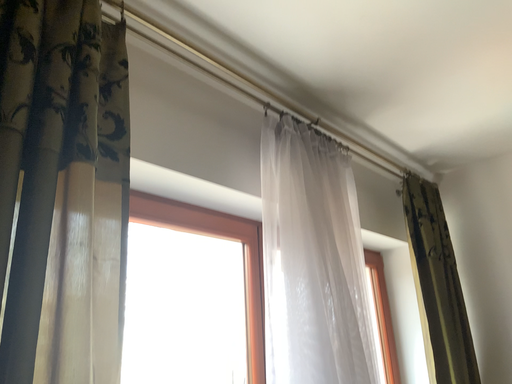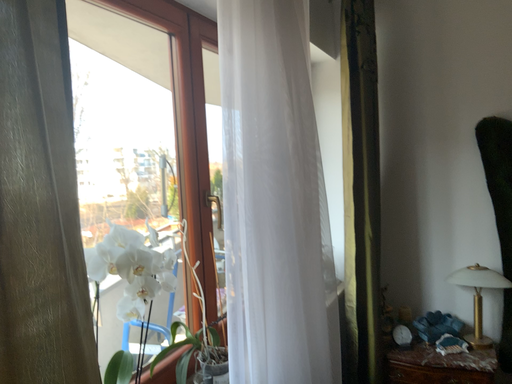
Question: Which way did the camera rotate in the video?

Choices:
 (A) rotated right
 (B) rotated left

Answer: (A)